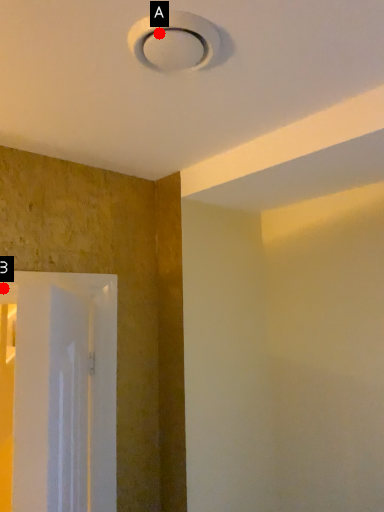
Question: Two points are circled on the image, labeled by A and B beside each circle. Which point appears closest to the camera in this image?

Choices:
 (A) A is closer
 (B) B is closer

Answer: (B)